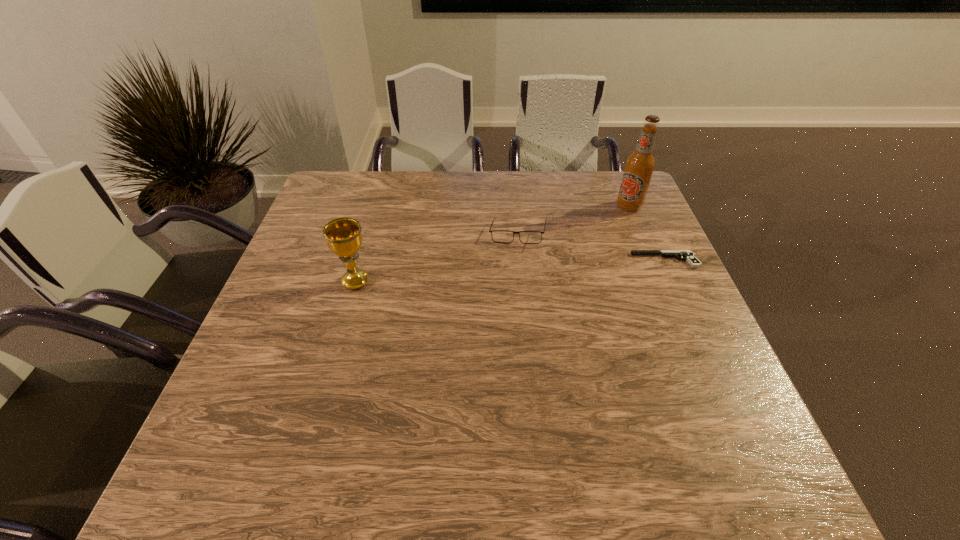
Where is `vacant space on the desktop that is between the leftmost object and the pistol and is positioned with the lenses facing outward on the second object from left to right`? vacant space on the desktop that is between the leftmost object and the pistol and is positioned with the lenses facing outward on the second object from left to right is located at coordinates (472, 274).

I want to click on free space on the desktop that is between the second tallest object and the shortest object and is positioned on the front label of the tallest object, so pyautogui.click(x=499, y=272).